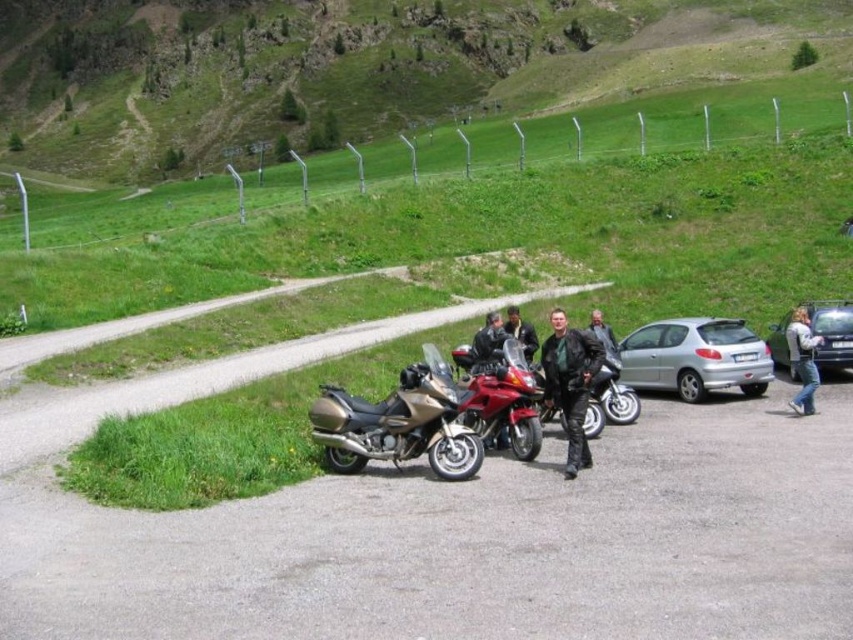
Is silver metallic sedan at right wider than dark brown leather jacket at center?

Incorrect, silver metallic sedan at right's width does not surpass dark brown leather jacket at center's.

Does silver metallic sedan at right come in front of dark brown leather jacket at center?

No, it is behind dark brown leather jacket at center.

Image resolution: width=853 pixels, height=640 pixels. Identify the location of silver metallic sedan at right. (833, 332).

Is point (735, 340) closer to camera compared to point (486, 440)?

That is False.

Measure the distance between silver metallic hatchback at center-right and shiny red motorcycle at center.

silver metallic hatchback at center-right is 7.09 meters away from shiny red motorcycle at center.

Which is in front, point (700, 368) or point (514, 444)?

Point (514, 444) is in front.

Locate an element on the screen. The image size is (853, 640). silver metallic hatchback at center-right is located at coordinates (695, 356).

Who is more forward, (x=820, y=301) or (x=795, y=333)?

Positioned in front is point (x=795, y=333).

Which of these two, silver metallic sedan at right or jeans at lower right, stands taller?

jeans at lower right

The height and width of the screenshot is (640, 853). Describe the element at coordinates (833, 332) in the screenshot. I see `silver metallic sedan at right` at that location.

Find the location of a particular element. This screenshot has height=640, width=853. silver metallic sedan at right is located at coordinates (833, 332).